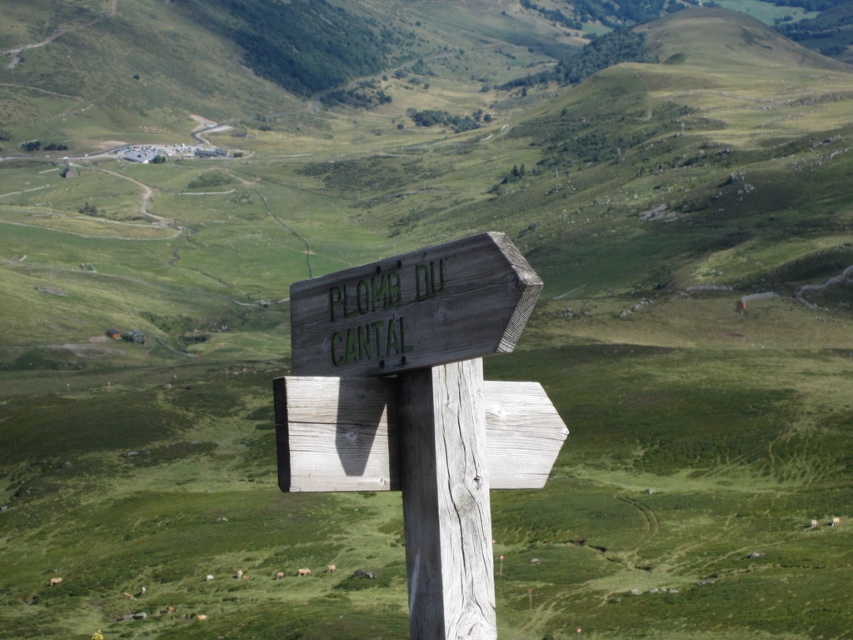
You are standing at the signpost and want to walk towards the direction the arrow is pointing. There are two points marked on the ground in front of you. One is at coordinates point (328, 316) and the other is at point (416, 596). Which point is closer to you as you face the direction the arrow is pointing?

Point (416, 596) is closer to you because point (328, 316) is behind it when facing the direction the arrow is pointing.

You are standing at the origin point in the image. Which direction should you walk to reach the wooden signpost at center?

The wooden signpost at center is located at point (419, 410), so you should walk towards the right and slightly forward to reach it.